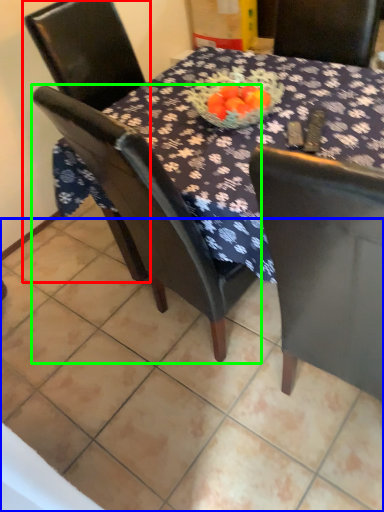
Question: Which object is the closest to the chair (highlighted by a red box)? Choose among these: tile (highlighted by a blue box) or chair (highlighted by a green box).

Choices:
 (A) tile
 (B) chair

Answer: (B)